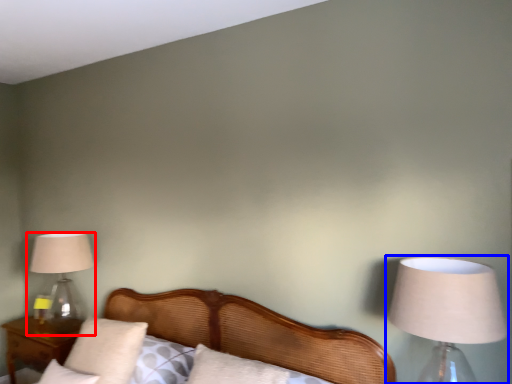
Question: Which object is closer to the camera taking this photo, lamp (highlighted by a red box) or lamp (highlighted by a blue box)?

Choices:
 (A) lamp
 (B) lamp

Answer: (B)